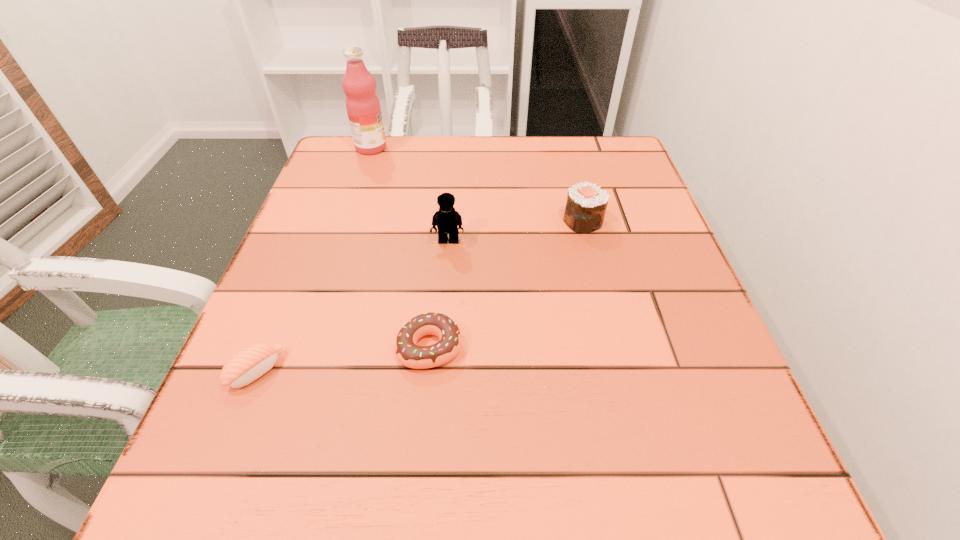
Locate an element on the screen. The width and height of the screenshot is (960, 540). free space between the doughnut and the third tallest object is located at coordinates (506, 284).

The image size is (960, 540). Identify the location of free point between the shorter sushi and the rightmost object. (420, 296).

Image resolution: width=960 pixels, height=540 pixels. Find the location of `unoccupied area between the doughnut and the fruit juice`. unoccupied area between the doughnut and the fruit juice is located at coordinates (400, 247).

The image size is (960, 540). In order to click on free area in between the doughnut and the tallest object in this screenshot , I will do `click(400, 247)`.

This screenshot has width=960, height=540. I want to click on free space between the nearer sushi and the farthest object, so click(x=314, y=259).

Find the location of a particular element. The height and width of the screenshot is (540, 960). object that is the third closest to the nearer sushi is located at coordinates (586, 204).

In order to click on the fourth closest object to the doughnut in this screenshot , I will do [x=363, y=107].

The width and height of the screenshot is (960, 540). I want to click on vacant region that satisfies the following two spatial constraints: 1. on the label of the fruit juice; 2. on the front side of the shorter sushi, so click(x=298, y=370).

Locate an element on the screen. The width and height of the screenshot is (960, 540). vacant area in the image that satisfies the following two spatial constraints: 1. on the label of the fruit juice; 2. on the right side of the taller sushi is located at coordinates (347, 221).

Image resolution: width=960 pixels, height=540 pixels. I want to click on vacant space that satisfies the following two spatial constraints: 1. on the back side of the doughnut; 2. on the label of the fruit juice, so point(448,148).